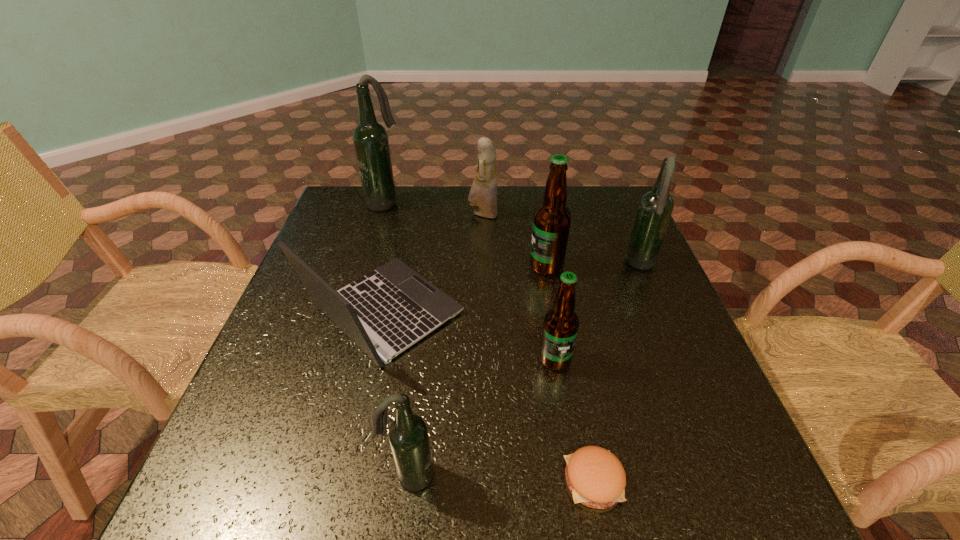
At what (x,y) coordinates should I click in order to perform the action: click on free point between the smaller brown beer bottle and the rightmost dark beer bottle. Please return your answer as a coordinate pair (x, y). This screenshot has height=540, width=960. Looking at the image, I should click on (598, 312).

You are a GUI agent. You are given a task and a screenshot of the screen. Output one action in this format:
    pyautogui.click(x=<x>, y=<y>)
    Task: Click on the unoccupied area between the rightmost beer bottle and the leftmost dark beer bottle
    Image resolution: width=960 pixels, height=540 pixels.
    Given the screenshot: What is the action you would take?
    [513, 234]

Where is `vacant area that lies between the leftmost dark beer bottle and the figurine`? vacant area that lies between the leftmost dark beer bottle and the figurine is located at coordinates (434, 208).

In order to click on unoccupied position between the laptop_computer and the fourth object from left to right in this screenshot , I will do `click(433, 264)`.

Where is `free space that is in between the laptop_computer and the leftmost dark beer bottle`? Image resolution: width=960 pixels, height=540 pixels. free space that is in between the laptop_computer and the leftmost dark beer bottle is located at coordinates (384, 258).

Identify which object is located as the third nearest to the laptop_computer. Please provide its 2D coordinates. Your answer should be formatted as a tuple, i.e. [(x, y)], where the tuple contains the x and y coordinates of a point satisfying the conditions above.

[(408, 436)]

Select which object is the third closest to the leftmost dark beer bottle. Please provide its 2D coordinates. Your answer should be formatted as a tuple, i.e. [(x, y)], where the tuple contains the x and y coordinates of a point satisfying the conditions above.

[(551, 223)]

Identify which beer bottle is the third closest to the fourth object from left to right. Please provide its 2D coordinates. Your answer should be formatted as a tuple, i.e. [(x, y)], where the tuple contains the x and y coordinates of a point satisfying the conditions above.

[(655, 208)]

At what (x,y) coordinates should I click in order to perform the action: click on the second closest beer bottle to the nearest dark beer bottle. Please return your answer as a coordinate pair (x, y). The height and width of the screenshot is (540, 960). Looking at the image, I should click on (551, 223).

Choose which dark beer bottle is the second nearest neighbor to the shortest object. Please provide its 2D coordinates. Your answer should be formatted as a tuple, i.e. [(x, y)], where the tuple contains the x and y coordinates of a point satisfying the conditions above.

[(655, 208)]